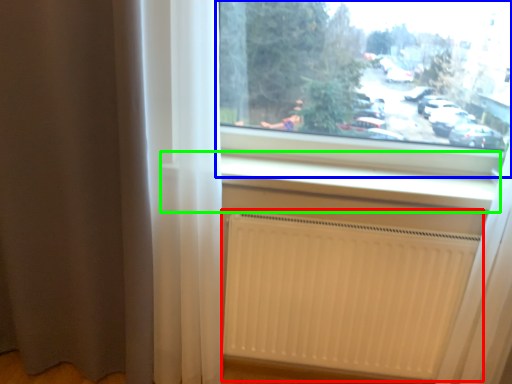
Question: Considering the real-world distances, which object is farthest from radiator (highlighted by a red box)? window (highlighted by a blue box) or window sill (highlighted by a green box)?

Choices:
 (A) window
 (B) window sill

Answer: (A)